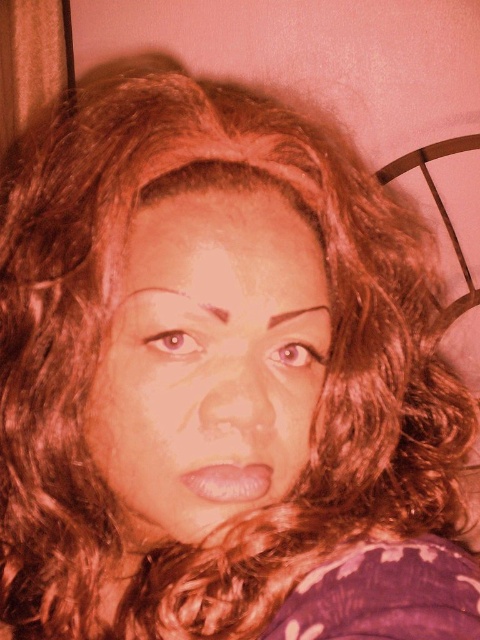
Question: Which object is farther from the camera taking this photo?

Choices:
 (A) brown matte eye at upper left
 (B) light brown eye at center

Answer: (B)

Question: Considering the relative positions of light brown eye at center and brown matte eyebrow at center in the image provided, where is light brown eye at center located with respect to brown matte eyebrow at center?

Choices:
 (A) above
 (B) below

Answer: (B)

Question: Can you confirm if brown matte eye at upper left is positioned below brown matte eyebrow at upper left?

Choices:
 (A) yes
 (B) no

Answer: (A)

Question: Which object appears closest to the camera in this image?

Choices:
 (A) brown matte eye at upper left
 (B) brown matte eyebrow at upper left
 (C) light brown eye at center
 (D) smooth skin at center

Answer: (B)

Question: Which is nearer to the brown matte eyebrow at center?

Choices:
 (A) light brown eye at center
 (B) matte skin face at center

Answer: (A)

Question: Does matte skin face at center appear on the right side of smooth skin at center?

Choices:
 (A) no
 (B) yes

Answer: (A)